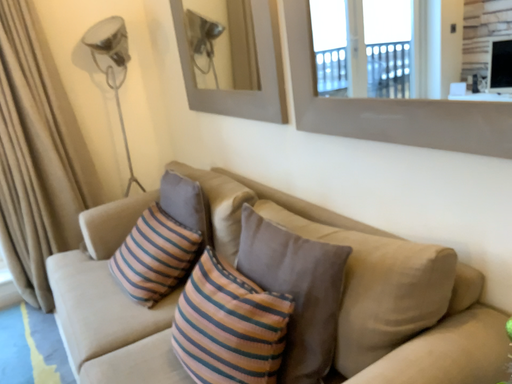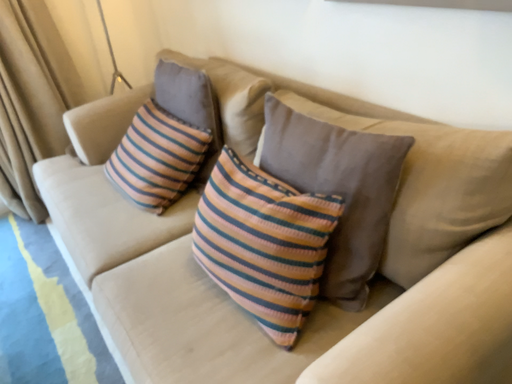
Question: Which way did the camera rotate in the video?

Choices:
 (A) rotated downward
 (B) rotated upward

Answer: (A)